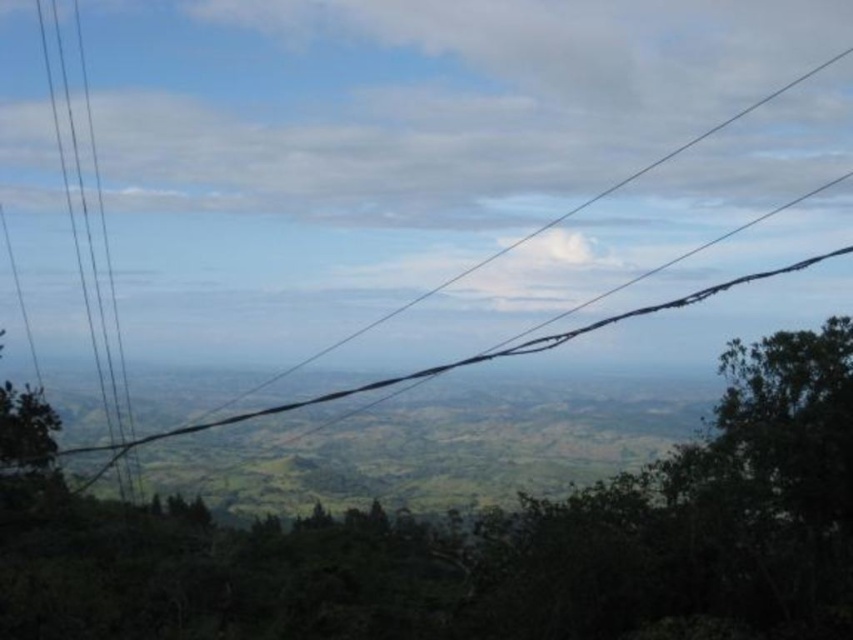
Question: Among these objects, which one is farthest from the camera?

Choices:
 (A) green leafy tree at center
 (B) black wire at center
 (C) black wire at left

Answer: (C)

Question: Which of the following is the closest to the observer?

Choices:
 (A) green leafy tree at center
 (B) black wire at center
 (C) black wire at left

Answer: (B)

Question: Which object appears farthest from the camera in this image?

Choices:
 (A) black wire at left
 (B) green leafy tree at center
 (C) black wire at center

Answer: (A)

Question: Does black wire at left have a lesser width compared to black wire at center?

Choices:
 (A) yes
 (B) no

Answer: (A)

Question: In this image, where is green leafy tree at center located relative to black wire at center?

Choices:
 (A) above
 (B) below

Answer: (B)

Question: Can you confirm if black wire at left is positioned to the right of black wire at center?

Choices:
 (A) no
 (B) yes

Answer: (A)